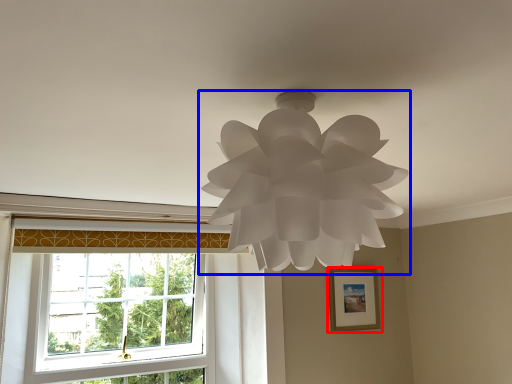
Question: Which object appears farthest to the camera in this image, picture frame (highlighted by a red box) or lamp (highlighted by a blue box)?

Choices:
 (A) picture frame
 (B) lamp

Answer: (A)